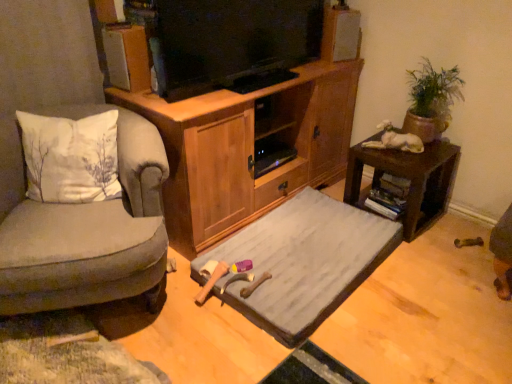
Question: From a real-world perspective, is white cotton pillow at left positioned above or below gray fabric bed at center?

Choices:
 (A) below
 (B) above

Answer: (B)

Question: Is white cotton pillow at left taller or shorter than gray fabric bed at center?

Choices:
 (A) short
 (B) tall

Answer: (B)

Question: Based on their relative distances, which object is nearer to the white cotton pillow at left?

Choices:
 (A) gray fabric bed at center
 (B) green clay pot at upper right
 (C) brown wooden desk at right
 (D) velvet grey armchair at left
 (E) wooden cabinet at center

Answer: (D)

Question: Which of these objects is positioned farthest from the brown wooden desk at right?

Choices:
 (A) wooden cabinet at center
 (B) velvet grey armchair at left
 (C) green clay pot at upper right
 (D) gray fabric bed at center
 (E) white cotton pillow at left

Answer: (E)